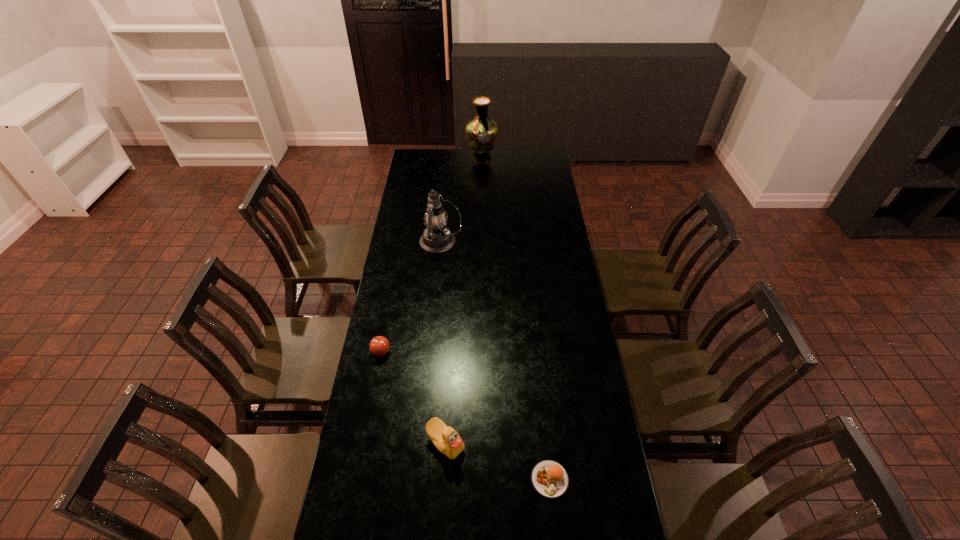
Image resolution: width=960 pixels, height=540 pixels. I want to click on vase, so click(481, 132).

Where is `the farthest object`? The width and height of the screenshot is (960, 540). the farthest object is located at coordinates (481, 132).

Where is `the second tallest object`? Image resolution: width=960 pixels, height=540 pixels. the second tallest object is located at coordinates (437, 238).

The image size is (960, 540). I want to click on oil lamp, so click(x=437, y=238).

This screenshot has height=540, width=960. Identify the location of duck. (446, 439).

Find the location of `the fourth tallest object`. the fourth tallest object is located at coordinates (379, 346).

Locate an element on the screen. The height and width of the screenshot is (540, 960). apple is located at coordinates (379, 346).

The height and width of the screenshot is (540, 960). I want to click on patty, so click(x=549, y=478).

Identify the location of the rightmost object. (549, 478).

This screenshot has width=960, height=540. Find the location of `vacant space located on the left of the tallest object`. vacant space located on the left of the tallest object is located at coordinates (410, 158).